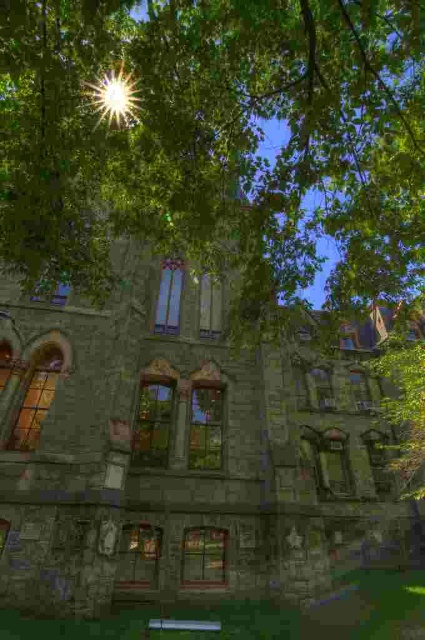
What do you see at coordinates (218, 138) in the screenshot?
I see `green leafy tree at center` at bounding box center [218, 138].

At what (x,y) coordinates should I click in order to perform the action: click on green leafy tree at center. Please return your answer as a coordinate pair (x, y). Looking at the image, I should click on (218, 138).

This screenshot has height=640, width=425. I want to click on green leafy tree at center, so point(218,138).